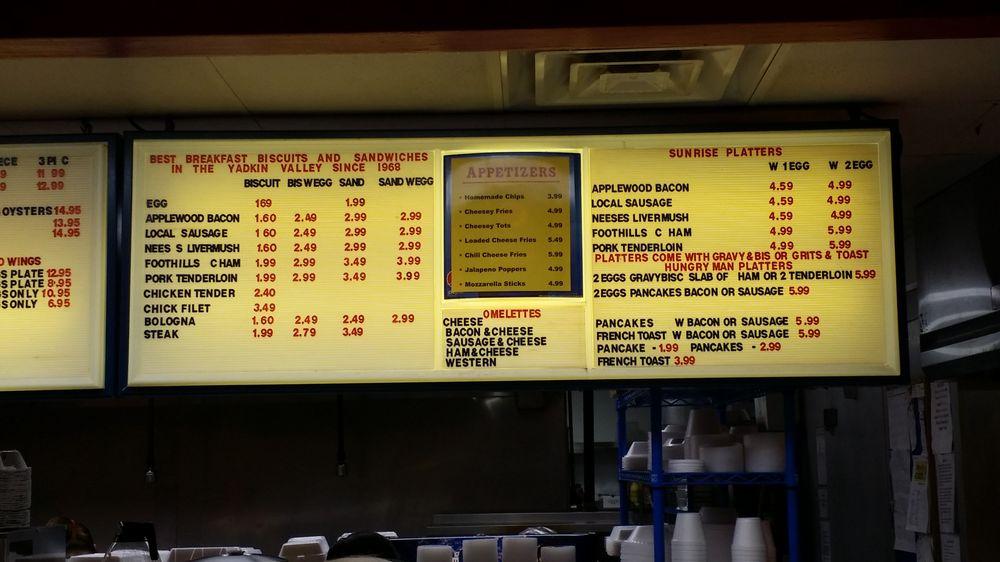
Where is `cups`? The image size is (1000, 562). cups is located at coordinates (748, 532), (683, 532).